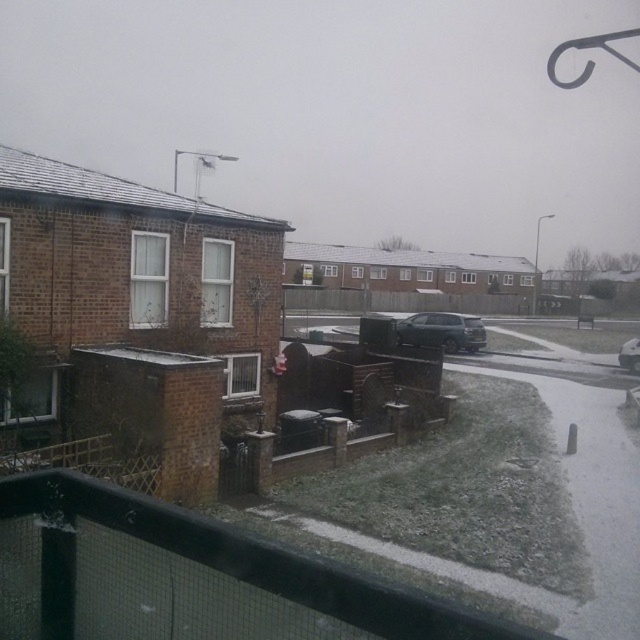
Question: Which point is closer to the camera?

Choices:
 (A) satin black car at center
 (B) white glossy car at center

Answer: (B)

Question: Is satin black car at center bigger than white glossy car at center?

Choices:
 (A) no
 (B) yes

Answer: (B)

Question: Is the position of satin black car at center more distant than that of white glossy car at center?

Choices:
 (A) no
 (B) yes

Answer: (B)

Question: Which point is farther to the camera?

Choices:
 (A) white glossy car at center
 (B) satin black car at center

Answer: (B)

Question: Which of the following is the farthest from the observer?

Choices:
 (A) (429, 321)
 (B) (632, 340)

Answer: (B)

Question: Does satin black car at center appear under white glossy car at center?

Choices:
 (A) yes
 (B) no

Answer: (B)